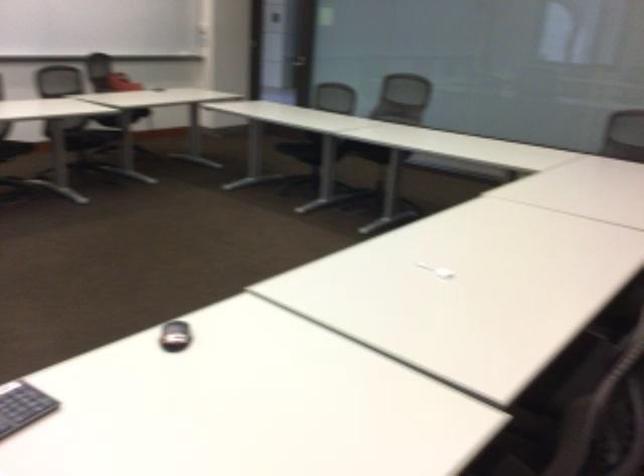
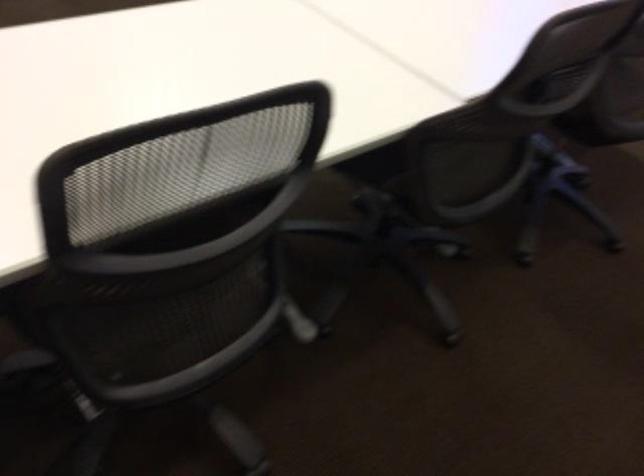
First-person continuous shooting, in which direction is the camera rotating?

The camera's rotation is toward right-down.